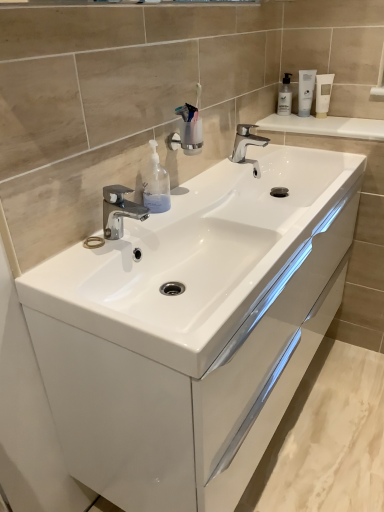
What do you see at coordinates (247, 145) in the screenshot?
I see `polished chrome tap at center, which is counted as the 1th tap, starting from the top` at bounding box center [247, 145].

Where is `polished chrome tap at center, placed as the first tap when sorted from front to back`? The image size is (384, 512). polished chrome tap at center, placed as the first tap when sorted from front to back is located at coordinates (119, 210).

What is the approximate width of white glossy cabinet at center?

The width of white glossy cabinet at center is 19.38 inches.

This screenshot has width=384, height=512. Describe the element at coordinates (285, 96) in the screenshot. I see `translucent plastic soap dispenser at upper right, positioned as the 2th soap dispenser in left-to-right order` at that location.

What is the approximate width of white glossy tube at upper right?

1.66 inches.

Image resolution: width=384 pixels, height=512 pixels. Identify the location of polished chrome tap at center, which is counted as the 1th tap, starting from the top. (247, 145).

Would you say polished chrome tap at center, which is counted as the 1th tap, starting from the top, is outside white glossy lotion at upper right?

Indeed, polished chrome tap at center, which is counted as the 1th tap, starting from the top, is completely outside white glossy lotion at upper right.

How many degrees apart are the facing directions of polished chrome tap at center, which is counted as the 1th tap, starting from the right, and white glossy lotion at upper right?

There is a 43.6-degree angle between the facing directions of polished chrome tap at center, which is counted as the 1th tap, starting from the right, and white glossy lotion at upper right.

From the picture: Is polished chrome tap at center, which is counted as the 1th tap, starting from the top, positioned far away from white glossy lotion at upper right?

No, polished chrome tap at center, which is counted as the 1th tap, starting from the top, is in close proximity to white glossy lotion at upper right.

Considering the sizes of objects polished chrome tap at center, the 2th tap ordered from the bottom, and white glossy lotion at upper right in the image provided, who is smaller, polished chrome tap at center, the 2th tap ordered from the bottom, or white glossy lotion at upper right?

With smaller size is white glossy lotion at upper right.

Identify the location of soap dispenser on the right side of white glossy cabinet at center. (285, 96).

What's the angular difference between white glossy cabinet at center and translucent plastic soap dispenser at upper right, acting as the first soap dispenser starting from the top,'s facing directions?

The facing directions of white glossy cabinet at center and translucent plastic soap dispenser at upper right, acting as the first soap dispenser starting from the top, are 89.7 degrees apart.

Looking at this image, which of these two, white glossy cabinet at center or translucent plastic soap dispenser at upper right, acting as the first soap dispenser starting from the top, stands shorter?

translucent plastic soap dispenser at upper right, acting as the first soap dispenser starting from the top, is shorter.

Is point (140, 327) positioned in front of point (279, 100)?

That is True.

Is polished chrome tap at center, the 2th tap positioned from the back, completely or partially outside of transparent plastic soap dispenser at center, which is counted as the 2th soap dispenser, starting from the back?

That's correct, polished chrome tap at center, the 2th tap positioned from the back, is outside of transparent plastic soap dispenser at center, which is counted as the 2th soap dispenser, starting from the back.

Is point (144, 209) in front of point (164, 168)?

Yes.

Between polished chrome tap at center, the second tap when ordered from top to bottom, and transparent plastic soap dispenser at center, which is counted as the 2th soap dispenser, starting from the top, which one has smaller width?

Thinner between the two is transparent plastic soap dispenser at center, which is counted as the 2th soap dispenser, starting from the top.

Considering the relative positions of transparent plastic soap dispenser at center, the first soap dispenser positioned from the front, and translucent plastic soap dispenser at upper right, positioned as the 2th soap dispenser in left-to-right order, in the image provided, is transparent plastic soap dispenser at center, the first soap dispenser positioned from the front, to the left or to the right of translucent plastic soap dispenser at upper right, positioned as the 2th soap dispenser in left-to-right order,?

In the image, transparent plastic soap dispenser at center, the first soap dispenser positioned from the front, appears on the left side of translucent plastic soap dispenser at upper right, positioned as the 2th soap dispenser in left-to-right order.

How distant is transparent plastic soap dispenser at center, the 1th soap dispenser from the bottom, from translucent plastic soap dispenser at upper right, positioned as the 2th soap dispenser in left-to-right order?

The distance of transparent plastic soap dispenser at center, the 1th soap dispenser from the bottom, from translucent plastic soap dispenser at upper right, positioned as the 2th soap dispenser in left-to-right order, is 88.12 centimeters.

Is transparent plastic soap dispenser at center, the second soap dispenser from the right, next to translucent plastic soap dispenser at upper right, the 2th soap dispenser viewed from the front, and touching it?

They are not placed beside each other.

From a real-world perspective, is transparent plastic soap dispenser at center, the 1th soap dispenser from the bottom, on top of translucent plastic soap dispenser at upper right, which ranks as the first soap dispenser in back-to-front order?

No.

From a real-world perspective, which is physically above, white glossy tube at upper right or transparent plastic soap dispenser at center, which is counted as the 2th soap dispenser, starting from the top?

Result: From a 3D spatial view, white glossy tube at upper right is above.

Which object is thinner, white glossy tube at upper right or transparent plastic soap dispenser at center, the second soap dispenser from the right?

white glossy tube at upper right is thinner.

How different are the orientations of white glossy tube at upper right and transparent plastic soap dispenser at center, which is counted as the 2th soap dispenser, starting from the back, in degrees?

The facing directions of white glossy tube at upper right and transparent plastic soap dispenser at center, which is counted as the 2th soap dispenser, starting from the back, are 51.6 degrees apart.

Relative to transparent plastic soap dispenser at center, the second soap dispenser from the right, is white glossy tube at upper right in front or behind?

Visually, white glossy tube at upper right is located behind transparent plastic soap dispenser at center, the second soap dispenser from the right.

Considering the points (299, 83) and (220, 372), which point is in front, point (299, 83) or point (220, 372)?

Positioned in front is point (220, 372).

Is there a large distance between white glossy lotion at upper right and white glossy cabinet at center?

white glossy lotion at upper right is far away from white glossy cabinet at center.

From a real-world perspective, is white glossy lotion at upper right physically located above or below white glossy cabinet at center?

From a real-world perspective, white glossy lotion at upper right is physically above white glossy cabinet at center.

In the scene shown: From the image's perspective, which object appears higher, white glossy lotion at upper right or polished chrome tap at center, the first tap when ordered from back to front?

From the image's view, white glossy lotion at upper right is above.

Which of these two, white glossy lotion at upper right or polished chrome tap at center, which ranks as the 2th tap in left-to-right order, is bigger?

polished chrome tap at center, which ranks as the 2th tap in left-to-right order.

Between white glossy lotion at upper right and polished chrome tap at center, positioned as the second tap in front-to-back order, which one appears on the right side from the viewer's perspective?

white glossy lotion at upper right is more to the right.

Which tap is the 1st one when counting from the left side of the white glossy lotion at upper right? Please provide its 2D coordinates.

[(247, 145)]

The width and height of the screenshot is (384, 512). Identify the location of the 2nd soap dispenser behind the white glossy cabinet at center, counting from the anchor's position. (285, 96).

When comparing their distances from white glossy tube at upper right, does white glossy lotion at upper right or transparent plastic soap dispenser at center, the first soap dispenser positioned from the front, seem closer?

white glossy lotion at upper right is closer to white glossy tube at upper right.

Looking at the image, which one is located closer to transparent plastic soap dispenser at center, the first soap dispenser positioned from the front, polished chrome tap at center, marked as the second tap in a right-to-left arrangement, or white glossy lotion at upper right?

polished chrome tap at center, marked as the second tap in a right-to-left arrangement, is closer to transparent plastic soap dispenser at center, the first soap dispenser positioned from the front.

When comparing their distances from white glossy lotion at upper right, does transparent plastic soap dispenser at center, the 1th soap dispenser from the bottom, or white glossy tube at upper right seem further?

transparent plastic soap dispenser at center, the 1th soap dispenser from the bottom, is positioned further to the anchor white glossy lotion at upper right.

Looking at the image, which one is located closer to white glossy cabinet at center, translucent plastic soap dispenser at upper right, the first soap dispenser when ordered from right to left, or polished chrome tap at center, marked as the second tap in a right-to-left arrangement?

Based on the image, polished chrome tap at center, marked as the second tap in a right-to-left arrangement, appears to be nearer to white glossy cabinet at center.

Based on their spatial positions, is white glossy cabinet at center or polished chrome tap at center, which is counted as the 1th tap, starting from the top, closer to white glossy lotion at upper right?

polished chrome tap at center, which is counted as the 1th tap, starting from the top, lies closer to white glossy lotion at upper right than the other object.

Estimate the real-world distances between objects in this image. Which object is closer to polished chrome tap at center, the 2th tap ordered from the bottom, white glossy lotion at upper right or white glossy tube at upper right?

Based on the image, white glossy lotion at upper right appears to be nearer to polished chrome tap at center, the 2th tap ordered from the bottom.

From the image, which object appears to be farther from white glossy lotion at upper right, white glossy tube at upper right or white glossy cabinet at center?

The object further to white glossy lotion at upper right is white glossy cabinet at center.

Consider the image. Considering their positions, is white glossy tube at upper right positioned closer to translucent plastic soap dispenser at upper right, the 2th soap dispenser viewed from the front, than transparent plastic soap dispenser at center, which is the first soap dispenser from left to right?

Based on the image, white glossy tube at upper right appears to be nearer to translucent plastic soap dispenser at upper right, the 2th soap dispenser viewed from the front.

This screenshot has height=512, width=384. I want to click on tap located between transparent plastic soap dispenser at center, the 1th soap dispenser from the bottom, and white glossy lotion at upper right in the depth direction, so click(x=247, y=145).

This screenshot has height=512, width=384. I want to click on tap located between polished chrome tap at center, marked as the second tap in a right-to-left arrangement, and translucent plastic soap dispenser at upper right, the 2th soap dispenser viewed from the front, in the depth direction, so click(x=247, y=145).

Locate an element on the screen. This screenshot has height=512, width=384. toiletry between translucent plastic soap dispenser at upper right, the first soap dispenser when ordered from right to left, and white glossy tube at upper right is located at coordinates (305, 91).

Where is `tap between white glossy cabinet at center and polished chrome tap at center, positioned as the second tap in front-to-back order, along the z-axis`? The image size is (384, 512). tap between white glossy cabinet at center and polished chrome tap at center, positioned as the second tap in front-to-back order, along the z-axis is located at coordinates (119, 210).